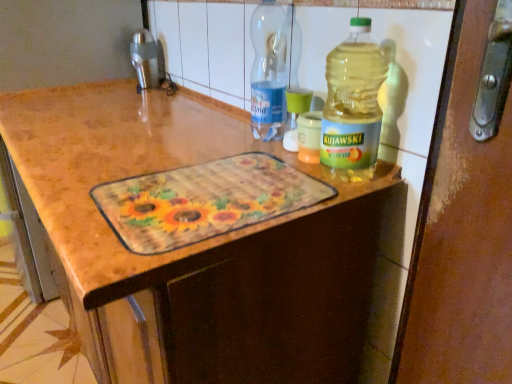
Describe the element at coordinates (353, 105) in the screenshot. I see `translucent plastic bottle at upper right, marked as the 1th bottle in a front-to-back arrangement` at that location.

You are a GUI agent. You are given a task and a screenshot of the screen. Output one action in this format:
    pyautogui.click(x=<x>, y=<y>)
    Task: Click on the metallic brushed faucet at upper left
    The image size is (512, 384).
    Given the screenshot: What is the action you would take?
    145,59

Considering the relative positions of translucent plastic bottle at upper right, arranged as the 2th bottle when viewed from the back, and metallic brushed faucet at upper left in the image provided, is translucent plastic bottle at upper right, arranged as the 2th bottle when viewed from the back, behind metallic brushed faucet at upper left?

No, translucent plastic bottle at upper right, arranged as the 2th bottle when viewed from the back, is closer to the viewer.

Is translucent plastic bottle at upper right, arranged as the 2th bottle when viewed from the back, directly adjacent to metallic brushed faucet at upper left?

No, translucent plastic bottle at upper right, arranged as the 2th bottle when viewed from the back, is not in contact with metallic brushed faucet at upper left.

Looking at this image, from the image's perspective, does translucent plastic bottle at upper right, marked as the 2th bottle in a left-to-right arrangement, appear lower than metallic brushed faucet at upper left?

Indeed, from the image's perspective, translucent plastic bottle at upper right, marked as the 2th bottle in a left-to-right arrangement, is shown beneath metallic brushed faucet at upper left.

From a real-world perspective, is translucent plastic bottle at upper right, placed as the 1th bottle when sorted from right to left, above or below metallic brushed faucet at upper left?

translucent plastic bottle at upper right, placed as the 1th bottle when sorted from right to left, is situated higher than metallic brushed faucet at upper left in the real world.

Can you confirm if transparent plastic bottle at center, which ranks as the 2th bottle in front-to-back order, is positioned to the left of metallic brushed faucet at upper left?

Incorrect, transparent plastic bottle at center, which ranks as the 2th bottle in front-to-back order, is not on the left side of metallic brushed faucet at upper left.

From a real-world perspective, between transparent plastic bottle at center, which ranks as the 2th bottle in right-to-left order, and metallic brushed faucet at upper left, who is vertically higher?

transparent plastic bottle at center, which ranks as the 2th bottle in right-to-left order, is physically above.

Which object is more forward, transparent plastic bottle at center, which appears as the first bottle when viewed from the back, or metallic brushed faucet at upper left?

Positioned in front is transparent plastic bottle at center, which appears as the first bottle when viewed from the back.

Which is more distant, (266, 120) or (137, 43)?

Point (137, 43)

Looking at their sizes, would you say transparent plastic bottle at center, which appears as the first bottle when viewed from the back, is wider or thinner than translucent plastic bottle at upper right, marked as the 2th bottle in a left-to-right arrangement?

In the image, transparent plastic bottle at center, which appears as the first bottle when viewed from the back, appears to be wider than translucent plastic bottle at upper right, marked as the 2th bottle in a left-to-right arrangement.

From the image's perspective, is transparent plastic bottle at center, which ranks as the 2th bottle in front-to-back order, below translucent plastic bottle at upper right, placed as the 1th bottle when sorted from right to left?

No.

Is transparent plastic bottle at center, which appears as the first bottle when viewed from the back, not close to translucent plastic bottle at upper right, arranged as the 2th bottle when viewed from the back?

No.

Looking at this image, is translucent plastic bottle at upper right, arranged as the 2th bottle when viewed from the back, further to camera compared to transparent plastic bottle at center, which ranks as the 2th bottle in right-to-left order?

No, the depth of translucent plastic bottle at upper right, arranged as the 2th bottle when viewed from the back, is less than that of transparent plastic bottle at center, which ranks as the 2th bottle in right-to-left order.

Would you say translucent plastic bottle at upper right, arranged as the 2th bottle when viewed from the back, is a long distance from transparent plastic bottle at center, which appears as the first bottle when viewed from the back?

No, translucent plastic bottle at upper right, arranged as the 2th bottle when viewed from the back, is not far from transparent plastic bottle at center, which appears as the first bottle when viewed from the back.

Can you tell me how much translucent plastic bottle at upper right, placed as the 1th bottle when sorted from right to left, and transparent plastic bottle at center, which ranks as the 2th bottle in right-to-left order, differ in facing direction?

The facing directions of translucent plastic bottle at upper right, placed as the 1th bottle when sorted from right to left, and transparent plastic bottle at center, which ranks as the 2th bottle in right-to-left order, are 0.00124 degrees apart.

Between translucent plastic bottle at upper right, marked as the 1th bottle in a front-to-back arrangement, and transparent plastic bottle at center, which ranks as the 2th bottle in right-to-left order, which one has more height?

With more height is transparent plastic bottle at center, which ranks as the 2th bottle in right-to-left order.

The width and height of the screenshot is (512, 384). Identify the location of the 1st bottle located above the metallic brushed faucet at upper left (from a real-world perspective). point(353,105).

How different are the orientations of metallic brushed faucet at upper left and translucent plastic bottle at upper right, arranged as the 2th bottle when viewed from the back, in degrees?

They differ by 0.00134 degrees in their facing directions.

How distant is metallic brushed faucet at upper left from translucent plastic bottle at upper right, arranged as the 2th bottle when viewed from the back?

metallic brushed faucet at upper left is 36.64 inches from translucent plastic bottle at upper right, arranged as the 2th bottle when viewed from the back.

Is metallic brushed faucet at upper left to the left of translucent plastic bottle at upper right, arranged as the 2th bottle when viewed from the back, from the viewer's perspective?

Yes, metallic brushed faucet at upper left is to the left of translucent plastic bottle at upper right, arranged as the 2th bottle when viewed from the back.

Who is smaller, metallic brushed faucet at upper left or transparent plastic bottle at center, arranged as the 1th bottle when viewed from the left?

With smaller size is metallic brushed faucet at upper left.

Between metallic brushed faucet at upper left and transparent plastic bottle at center, arranged as the 1th bottle when viewed from the left, which one is positioned in front?

Positioned in front is transparent plastic bottle at center, arranged as the 1th bottle when viewed from the left.

From the image's perspective, would you say metallic brushed faucet at upper left is positioned over transparent plastic bottle at center, which ranks as the 2th bottle in right-to-left order?

Indeed, from the image's perspective, metallic brushed faucet at upper left is shown above transparent plastic bottle at center, which ranks as the 2th bottle in right-to-left order.

Looking at their sizes, would you say metallic brushed faucet at upper left is wider or thinner than transparent plastic bottle at center, arranged as the 1th bottle when viewed from the left?

In the image, metallic brushed faucet at upper left appears to be more narrow than transparent plastic bottle at center, arranged as the 1th bottle when viewed from the left.

There is a metallic brushed faucet at upper left. At what (x,y) coordinates should I click in order to perform the action: click on the 2nd bottle below it (from the image's perspective). Please return your answer as a coordinate pair (x, y). This screenshot has height=384, width=512. Looking at the image, I should click on (353, 105).

Where is `appliance that is on the left side of transparent plastic bottle at center, which appears as the first bottle when viewed from the back`? appliance that is on the left side of transparent plastic bottle at center, which appears as the first bottle when viewed from the back is located at coordinates (145, 59).

Which object lies further to the anchor point transparent plastic bottle at center, which ranks as the 2th bottle in right-to-left order, metallic brushed faucet at upper left or translucent plastic bottle at upper right, arranged as the 2th bottle when viewed from the back?

metallic brushed faucet at upper left is positioned further to the anchor transparent plastic bottle at center, which ranks as the 2th bottle in right-to-left order.

When comparing their distances from metallic brushed faucet at upper left, does translucent plastic bottle at upper right, marked as the 2th bottle in a left-to-right arrangement, or transparent plastic bottle at center, arranged as the 1th bottle when viewed from the left, seem closer?

transparent plastic bottle at center, arranged as the 1th bottle when viewed from the left, lies closer to metallic brushed faucet at upper left than the other object.

Based on their spatial positions, is transparent plastic bottle at center, which appears as the first bottle when viewed from the back, or translucent plastic bottle at upper right, marked as the 1th bottle in a front-to-back arrangement, further from metallic brushed faucet at upper left?

translucent plastic bottle at upper right, marked as the 1th bottle in a front-to-back arrangement, is further to metallic brushed faucet at upper left.

When comparing their distances from transparent plastic bottle at center, which appears as the first bottle when viewed from the back, does translucent plastic bottle at upper right, placed as the 1th bottle when sorted from right to left, or metallic brushed faucet at upper left seem closer?

Based on the image, translucent plastic bottle at upper right, placed as the 1th bottle when sorted from right to left, appears to be nearer to transparent plastic bottle at center, which appears as the first bottle when viewed from the back.

Which object lies nearer to the anchor point translucent plastic bottle at upper right, placed as the 1th bottle when sorted from right to left, metallic brushed faucet at upper left or transparent plastic bottle at center, arranged as the 1th bottle when viewed from the left?

transparent plastic bottle at center, arranged as the 1th bottle when viewed from the left, is closer to translucent plastic bottle at upper right, placed as the 1th bottle when sorted from right to left.

Considering their positions, is transparent plastic bottle at center, which ranks as the 2th bottle in front-to-back order, positioned further to translucent plastic bottle at upper right, marked as the 2th bottle in a left-to-right arrangement, than metallic brushed faucet at upper left?

Among the two, metallic brushed faucet at upper left is located further to translucent plastic bottle at upper right, marked as the 2th bottle in a left-to-right arrangement.

The image size is (512, 384). Find the location of `bottle between translucent plastic bottle at upper right, marked as the 2th bottle in a left-to-right arrangement, and metallic brushed faucet at upper left in the front-back direction`. bottle between translucent plastic bottle at upper right, marked as the 2th bottle in a left-to-right arrangement, and metallic brushed faucet at upper left in the front-back direction is located at coordinates (268, 71).